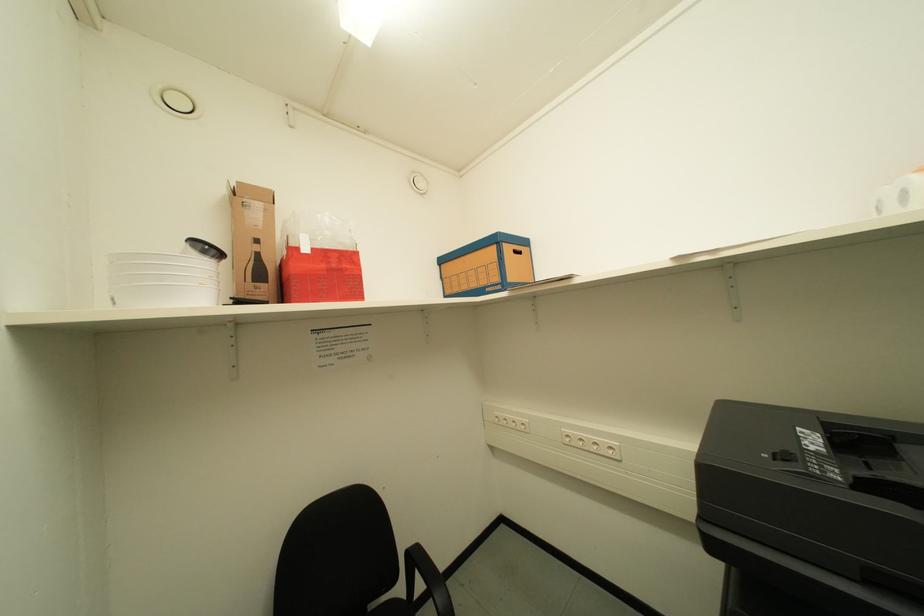
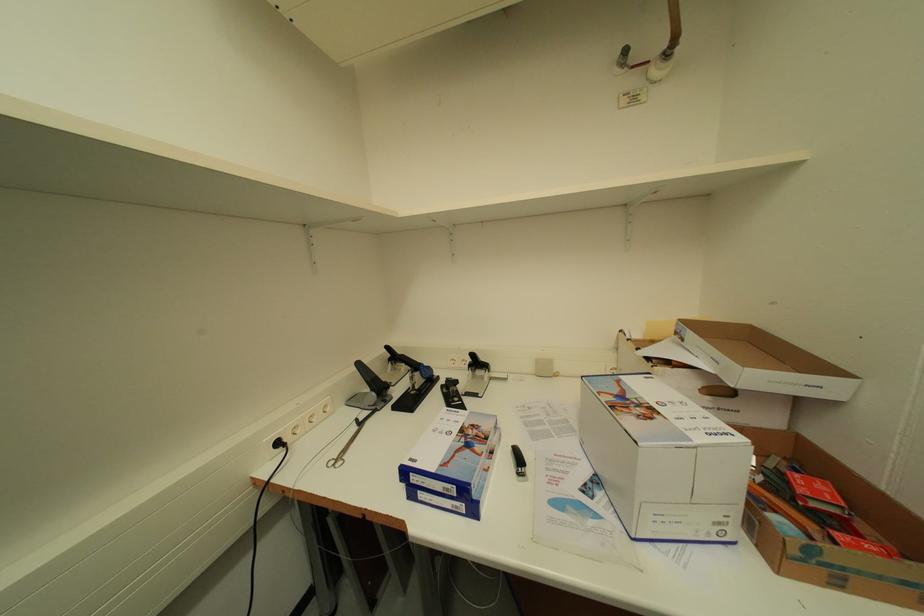
Question: The camera is either moving clockwise (left) or counter-clockwise (right) around the object. The first image is from the beginning of the video and the second image is from the end. Is the camera moving left or right when shooting the video?

Choices:
 (A) Left
 (B) Right

Answer: (A)